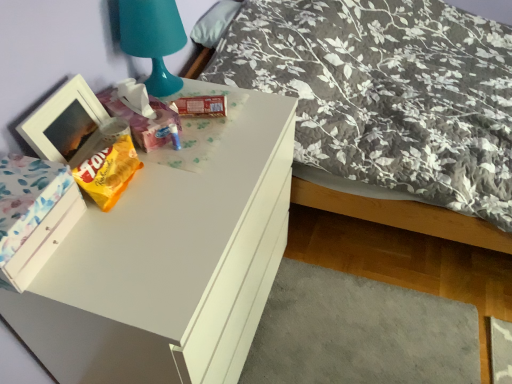
Question: Should I look upward or downward to see teal plastic table lamp at upper left?

Choices:
 (A) up
 (B) down

Answer: (A)

Question: Is white painted wood drawer at lower left oriented towards white matte picture frame at left?

Choices:
 (A) no
 (B) yes

Answer: (A)

Question: Is the surface of white painted wood drawer at lower left in direct contact with white matte picture frame at left?

Choices:
 (A) no
 (B) yes

Answer: (A)

Question: Considering the relative positions of white painted wood drawer at lower left and white matte picture frame at left in the image provided, is white painted wood drawer at lower left to the right of white matte picture frame at left from the viewer's perspective?

Choices:
 (A) no
 (B) yes

Answer: (A)

Question: Is the position of white painted wood drawer at lower left more distant than that of white matte picture frame at left?

Choices:
 (A) yes
 (B) no

Answer: (B)

Question: Considering the relative positions of white painted wood drawer at lower left and white matte picture frame at left in the image provided, is white painted wood drawer at lower left in front of white matte picture frame at left?

Choices:
 (A) no
 (B) yes

Answer: (B)

Question: Considering the relative sizes of white painted wood drawer at lower left and white matte picture frame at left in the image provided, is white painted wood drawer at lower left shorter than white matte picture frame at left?

Choices:
 (A) no
 (B) yes

Answer: (B)

Question: From the image's perspective, is teal plastic table lamp at upper left on top of fluffy gray pillow at upper center?

Choices:
 (A) yes
 (B) no

Answer: (B)

Question: Is teal plastic table lamp at upper left wider than fluffy gray pillow at upper center?

Choices:
 (A) yes
 (B) no

Answer: (A)

Question: Is teal plastic table lamp at upper left to the right of fluffy gray pillow at upper center from the viewer's perspective?

Choices:
 (A) yes
 (B) no

Answer: (B)

Question: Considering the relative positions of teal plastic table lamp at upper left and fluffy gray pillow at upper center in the image provided, is teal plastic table lamp at upper left to the left of fluffy gray pillow at upper center from the viewer's perspective?

Choices:
 (A) no
 (B) yes

Answer: (B)

Question: From the image's perspective, does teal plastic table lamp at upper left appear lower than fluffy gray pillow at upper center?

Choices:
 (A) yes
 (B) no

Answer: (A)

Question: Is the position of teal plastic table lamp at upper left more distant than that of fluffy gray pillow at upper center?

Choices:
 (A) no
 (B) yes

Answer: (A)

Question: Does white painted wood drawer at lower left have a lesser width compared to matte plastic tissue box at upper center, which is the 1th package in left-to-right order?

Choices:
 (A) no
 (B) yes

Answer: (B)